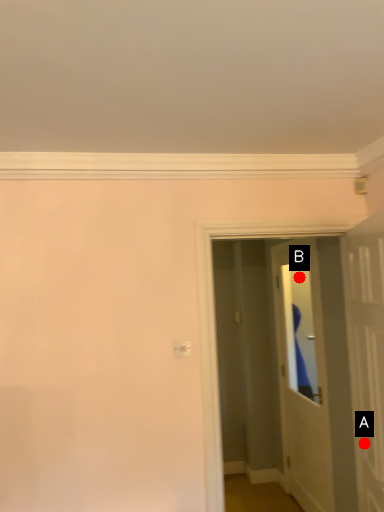
Question: Two points are circled on the image, labeled by A and B beside each circle. Which point appears closest to the camera in this image?

Choices:
 (A) A is closer
 (B) B is closer

Answer: (A)